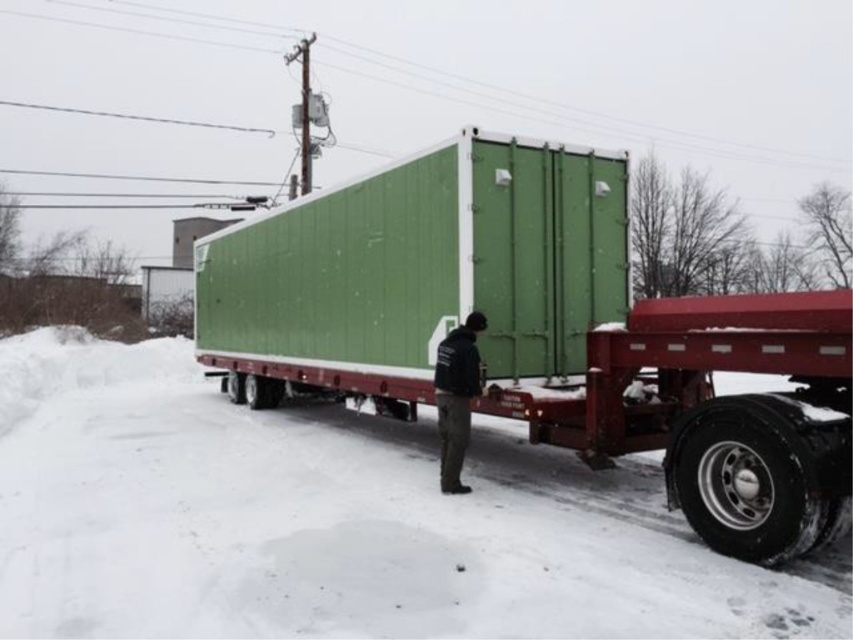
Question: Which point is closer to the camera?

Choices:
 (A) green matte container at center
 (B) white powdery snow at lower center

Answer: (B)

Question: Can you confirm if white powdery snow at lower center is positioned above dark green jacket at center?

Choices:
 (A) no
 (B) yes

Answer: (A)

Question: Does white powdery snow at lower center appear on the left side of green matte container at center?

Choices:
 (A) no
 (B) yes

Answer: (B)

Question: Considering the real-world distances, which object is farthest from the dark green jacket at center?

Choices:
 (A) green matte container at center
 (B) white powdery snow at lower center

Answer: (B)

Question: Which of these objects is positioned farthest from the dark green jacket at center?

Choices:
 (A) green matte container at center
 (B) white powdery snow at lower center

Answer: (B)

Question: In this image, where is white powdery snow at lower center located relative to green matte container at center?

Choices:
 (A) left
 (B) right

Answer: (A)